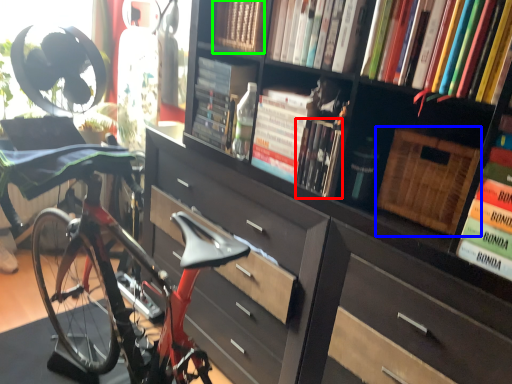
Question: Estimate the real-world distances between objects in this image. Which object is closer to book (highlighted by a red box), basket (highlighted by a blue box) or book (highlighted by a green box)?

Choices:
 (A) basket
 (B) book

Answer: (A)